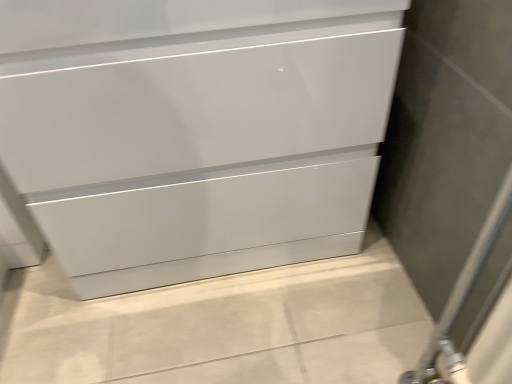
Locate an element on the screen. The width and height of the screenshot is (512, 384). matte gray screen door at right is located at coordinates (446, 138).

Image resolution: width=512 pixels, height=384 pixels. What do you see at coordinates (446, 138) in the screenshot? I see `matte gray screen door at right` at bounding box center [446, 138].

What do you see at coordinates (195, 131) in the screenshot? I see `glossy white chest of drawers at center` at bounding box center [195, 131].

At what (x,y) coordinates should I click in order to perform the action: click on glossy white chest of drawers at center. Please return your answer as a coordinate pair (x, y). Image resolution: width=512 pixels, height=384 pixels. Looking at the image, I should click on (195, 131).

The height and width of the screenshot is (384, 512). I want to click on matte gray screen door at right, so click(x=446, y=138).

Between glossy white chest of drawers at center and matte gray screen door at right, which one appears on the right side from the viewer's perspective?

matte gray screen door at right is more to the right.

Considering the relative positions of glossy white chest of drawers at center and matte gray screen door at right in the image provided, is glossy white chest of drawers at center behind matte gray screen door at right?

Yes, it is.

Which is closer to the camera, (x=258, y=78) or (x=443, y=273)?

The point (x=258, y=78) is in front.

From the image's perspective, relative to matte gray screen door at right, is glossy white chest of drawers at center above or below?

glossy white chest of drawers at center is situated higher than matte gray screen door at right in the image.

From a real-world perspective, is glossy white chest of drawers at center physically located above or below matte gray screen door at right?

glossy white chest of drawers at center is situated lower than matte gray screen door at right in the real world.

Is glossy white chest of drawers at center thinner than matte gray screen door at right?

No, glossy white chest of drawers at center is not thinner than matte gray screen door at right.

Considering the relative sizes of glossy white chest of drawers at center and matte gray screen door at right in the image provided, is glossy white chest of drawers at center shorter than matte gray screen door at right?

Indeed, glossy white chest of drawers at center has a lesser height compared to matte gray screen door at right.

Who is smaller, glossy white chest of drawers at center or matte gray screen door at right?

With smaller size is matte gray screen door at right.

Would you say matte gray screen door at right is part of glossy white chest of drawers at center's contents?

Actually, matte gray screen door at right is outside glossy white chest of drawers at center.

Are glossy white chest of drawers at center and matte gray screen door at right located far from each other?

They are positioned close to each other.

Is glossy white chest of drawers at center facing towards matte gray screen door at right?

Yes, glossy white chest of drawers at center is turned towards matte gray screen door at right.

What's the angular difference between glossy white chest of drawers at center and matte gray screen door at right's facing directions?

glossy white chest of drawers at center and matte gray screen door at right are facing 89.2 degrees away from each other.

In the image, there is a matte gray screen door at right. What are the coordinates of `the chest of drawers above it (from the image's perspective)` in the screenshot? It's located at (195, 131).

Between matte gray screen door at right and glossy white chest of drawers at center, which one appears on the right side from the viewer's perspective?

From the viewer's perspective, matte gray screen door at right appears more on the right side.

Considering the relative positions of matte gray screen door at right and glossy white chest of drawers at center in the image provided, is matte gray screen door at right in front of glossy white chest of drawers at center?

Yes, it is.

Which point is more forward, (x=449, y=29) or (x=278, y=47)?

The point (x=278, y=47) is in front.

From the image's perspective, is matte gray screen door at right on top of glossy white chest of drawers at center?

No.

Looking at this image, from a real-world perspective, which is physically below, matte gray screen door at right or glossy white chest of drawers at center?

glossy white chest of drawers at center, from a real-world perspective.

Is matte gray screen door at right thinner than glossy white chest of drawers at center?

Yes, matte gray screen door at right is thinner than glossy white chest of drawers at center.

In terms of height, does matte gray screen door at right look taller or shorter compared to glossy white chest of drawers at center?

In the image, matte gray screen door at right appears to be taller than glossy white chest of drawers at center.

Which of these two, matte gray screen door at right or glossy white chest of drawers at center, is bigger?

glossy white chest of drawers at center is bigger.

Is matte gray screen door at right not inside glossy white chest of drawers at center?

Yes, matte gray screen door at right is located beyond the bounds of glossy white chest of drawers at center.

Is matte gray screen door at right not near glossy white chest of drawers at center?

Actually, matte gray screen door at right and glossy white chest of drawers at center are a little close together.

Could you tell me if matte gray screen door at right is facing glossy white chest of drawers at center?

No, matte gray screen door at right is not facing towards glossy white chest of drawers at center.

How far apart are matte gray screen door at right and glossy white chest of drawers at center?

The distance of matte gray screen door at right from glossy white chest of drawers at center is 14.67 inches.

Where is `screen door on the right of glossy white chest of drawers at center`? screen door on the right of glossy white chest of drawers at center is located at coordinates (446, 138).

Image resolution: width=512 pixels, height=384 pixels. Find the location of `screen door located on the right of glossy white chest of drawers at center`. screen door located on the right of glossy white chest of drawers at center is located at coordinates coord(446,138).

Image resolution: width=512 pixels, height=384 pixels. I want to click on chest of drawers above the matte gray screen door at right (from the image's perspective), so click(195, 131).